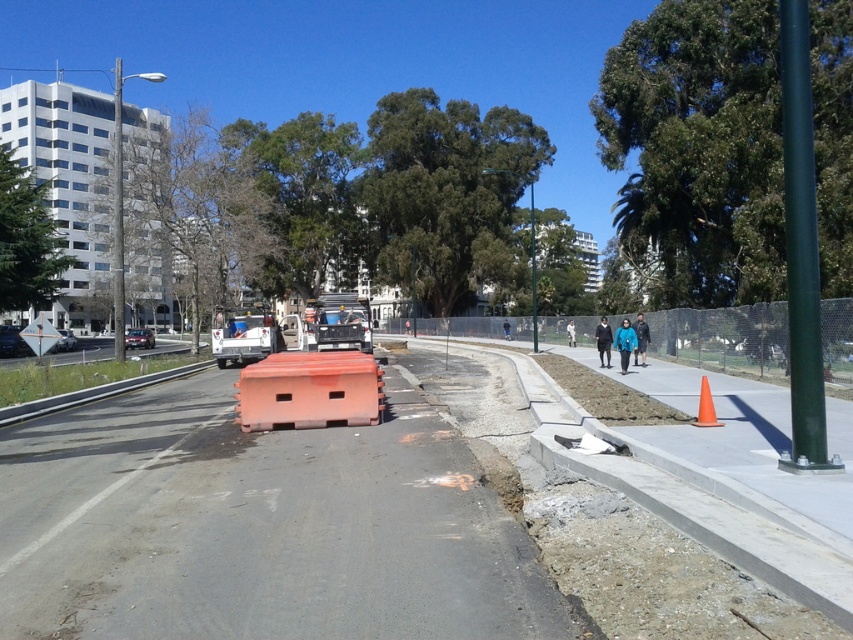
Measure the distance between orange plastic barricade at center and camera.

The distance of orange plastic barricade at center from camera is 11.55 meters.

Can you confirm if orange plastic barricade at center is positioned below brushed metal highway at lower left?

Yes, orange plastic barricade at center is below brushed metal highway at lower left.

Who is more distant from viewer, (268, 419) or (57, 360)?

Point (57, 360)

Where is `orange plastic barricade at center`? orange plastic barricade at center is located at coordinates (309, 390).

Is orange plastic barrier at center to the left of orange plastic barricade at center from the viewer's perspective?

In fact, orange plastic barrier at center is to the right of orange plastic barricade at center.

How much distance is there between orange plastic barrier at center and orange plastic barricade at center?

orange plastic barrier at center and orange plastic barricade at center are 8.35 feet apart from each other.

This screenshot has width=853, height=640. Find the location of `orange plastic barrier at center`. orange plastic barrier at center is located at coordinates (258, 528).

Is orange plastic barrier at center further to the viewer compared to brushed metal highway at lower left?

That is False.

Which is more to the right, orange plastic barrier at center or brushed metal highway at lower left?

Positioned to the right is orange plastic barrier at center.

Is point (26, 474) positioned in front of point (184, 348)?

Yes, point (26, 474) is in front of point (184, 348).

Image resolution: width=853 pixels, height=640 pixels. In order to click on orange plastic barrier at center in this screenshot , I will do `click(258, 528)`.